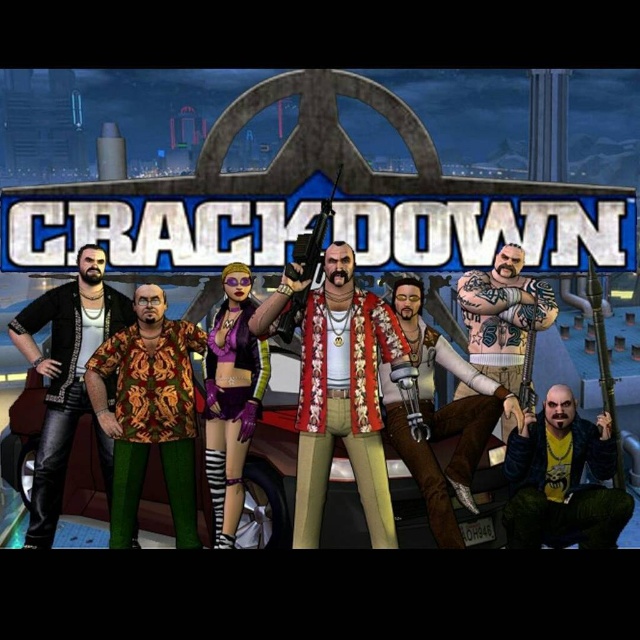
Question: Is purple matte/soft fabric at center positioned before metallic silver gun at center?

Choices:
 (A) no
 (B) yes

Answer: (A)

Question: Considering the real-world distances, which object is farthest from the printed fabric shirt at center?

Choices:
 (A) metallic silver gun at center
 (B) leather jacket at center
 (C) purple matte/soft fabric at center
 (D) leather jacket at left

Answer: (B)

Question: Among these objects, which one is nearest to the camera?

Choices:
 (A) purple matte/soft fabric at center
 (B) reddish-brown leather jacket at center
 (C) yellow-green leather jacket at lower right

Answer: (C)

Question: Can you confirm if printed fabric shirt at center is thinner than yellow-green leather jacket at lower right?

Choices:
 (A) yes
 (B) no

Answer: (A)

Question: Does purple matte/soft fabric at center appear on the left side of tattooed skin at center?

Choices:
 (A) no
 (B) yes

Answer: (B)

Question: Estimate the real-world distances between objects in this image. Which object is closer to the metallic silver gun at center?

Choices:
 (A) purple matte/soft fabric at center
 (B) leather jacket at left

Answer: (A)